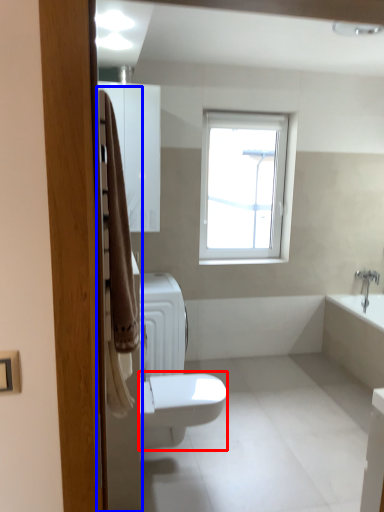
Question: Which of the following is the closest to the observer, bidet (highlighted by a red box) or screen door (highlighted by a blue box)?

Choices:
 (A) bidet
 (B) screen door

Answer: (B)